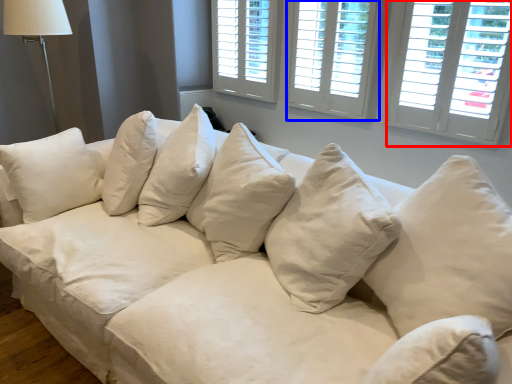
Question: Among these objects, which one is farthest to the camera, window (highlighted by a red box) or window (highlighted by a blue box)?

Choices:
 (A) window
 (B) window

Answer: (B)